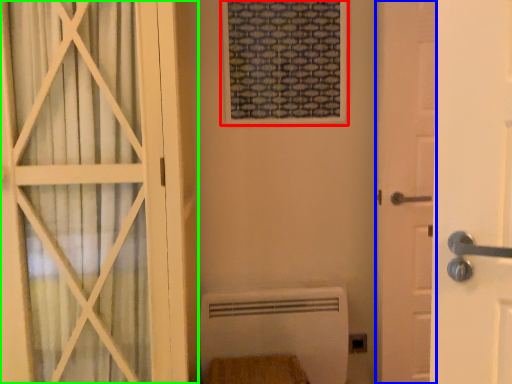
Question: Which is nearer to the window frame (highlighted by a red box)? door (highlighted by a blue box) or door (highlighted by a green box).

Choices:
 (A) door
 (B) door

Answer: (A)